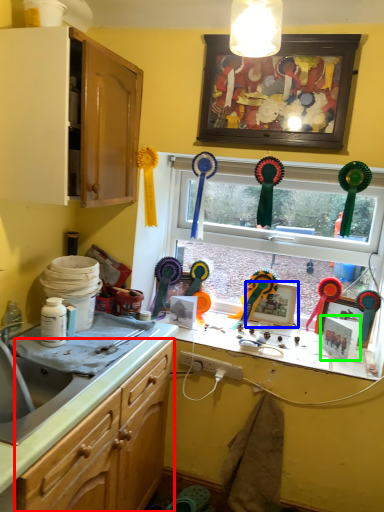
Question: Based on their relative distances, which object is nearer to cabinetry (highlighted by a red box)? Choose from picture frame (highlighted by a blue box) and picture frame (highlighted by a green box).

Choices:
 (A) picture frame
 (B) picture frame

Answer: (A)